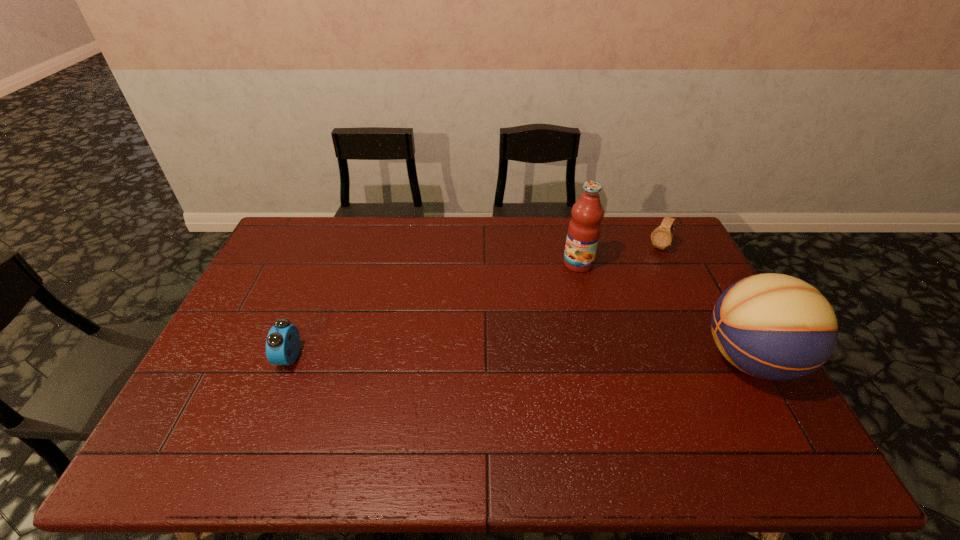
Find the location of a particular element. The image size is (960, 540). watch that is positioned at the right edge is located at coordinates point(661,237).

This screenshot has width=960, height=540. I want to click on object positioned at the far right corner, so click(661, 237).

You are a GUI agent. You are given a task and a screenshot of the screen. Output one action in this format:
    pyautogui.click(x=<x>, y=<y>)
    Task: Click on the object located in the near right corner section of the desktop
    This screenshot has width=960, height=540.
    Given the screenshot: What is the action you would take?
    pyautogui.click(x=772, y=326)

I want to click on vacant region at the far edge of the desktop, so click(331, 230).

At what (x,y) coordinates should I click in order to perform the action: click on free space at the left edge of the desktop. Please return your answer as a coordinate pair (x, y). Looking at the image, I should click on (242, 346).

In the image, there is a desktop. At what (x,y) coordinates should I click in order to perform the action: click on vacant space at the far left corner. Please return your answer as a coordinate pair (x, y). The image size is (960, 540). Looking at the image, I should click on (305, 254).

The height and width of the screenshot is (540, 960). In the image, there is a desktop. Find the location of `vacant space at the far right corner`. vacant space at the far right corner is located at coordinates (636, 236).

Locate an element on the screen. unoccupied area between the fruit juice and the leftmost object is located at coordinates (434, 310).

Image resolution: width=960 pixels, height=540 pixels. What are the coordinates of `blank region between the basketball and the watch` in the screenshot? It's located at (705, 303).

The image size is (960, 540). Identify the location of empty space that is in between the basketball and the leftmost object. (519, 359).